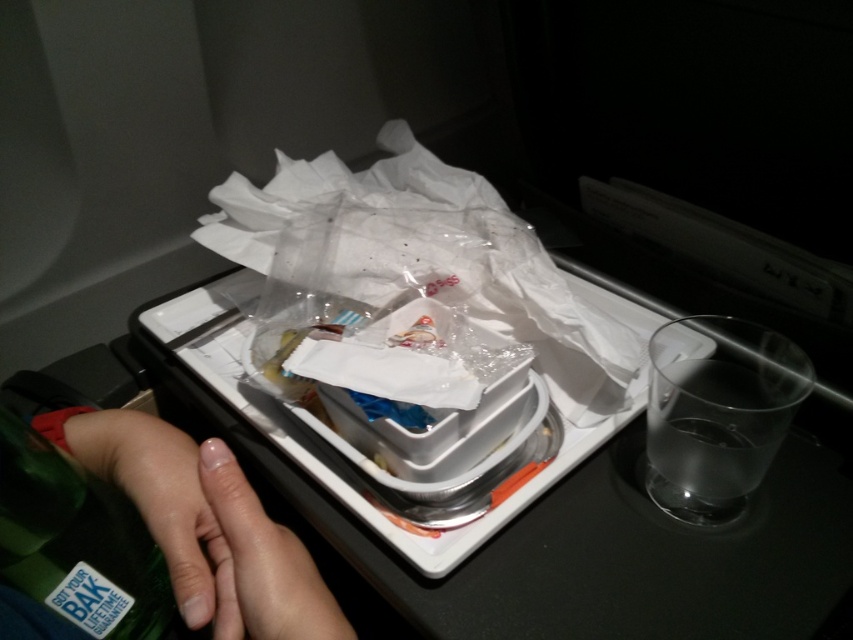
You are a flight attendant checking the items on a passenger tray table. You need to determine which item takes up more space. Which is larger in size between the transparent plastic bag at center and the green matte bottle at lower left?

The transparent plastic bag at center is bigger than the green matte bottle at lower left, so the transparent plastic bag at center takes up more space.

In the scene shown: You are a flight attendant checking the tray tables. You need to place a camera on the tray table so that it is exactly 21.15 inches away from the transparent plastic bag at center. Where should you place the camera?

You should place the camera exactly 21.15 inches away from the transparent plastic bag at center, as the distance between them is specified to be 21.15 inches.